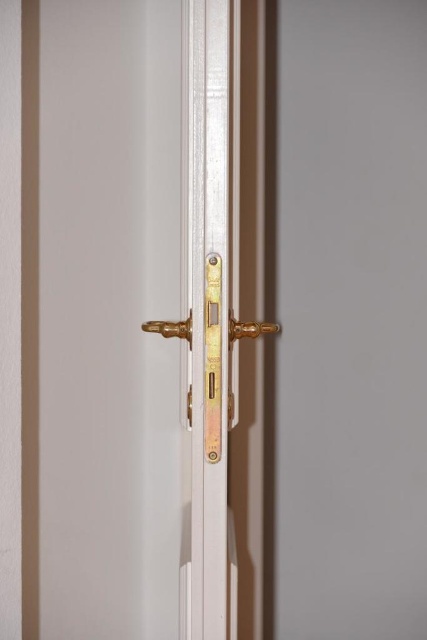
Question: Which object is positioned closest to the gold polished door handle at center?

Choices:
 (A) white glossy door handle at center
 (B) polished brass door handle at center
 (C) gold metallic door handle at center

Answer: (B)

Question: Is white glossy door handle at center to the right of gold metallic door handle at center from the viewer's perspective?

Choices:
 (A) yes
 (B) no

Answer: (B)

Question: Can you confirm if white glossy door handle at center is bigger than gold polished door handle at center?

Choices:
 (A) yes
 (B) no

Answer: (A)

Question: Which of the following is the closest to the observer?

Choices:
 (A) gold polished door handle at center
 (B) white glossy door handle at center
 (C) polished brass door handle at center

Answer: (B)

Question: Can you confirm if white glossy door handle at center is smaller than gold metallic door handle at center?

Choices:
 (A) no
 (B) yes

Answer: (A)

Question: Among these objects, which one is nearest to the camera?

Choices:
 (A) white glossy door handle at center
 (B) polished brass door handle at center

Answer: (A)